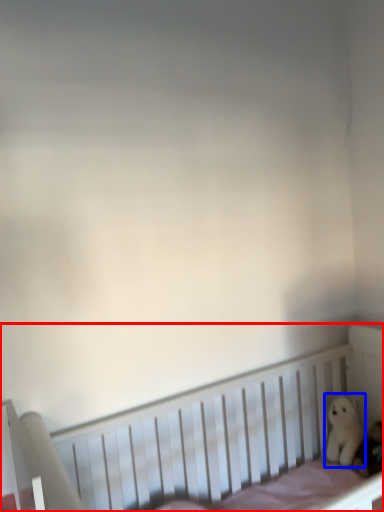
Question: Which point is further to the camera, infant bed (highlighted by a red box) or toy (highlighted by a blue box)?

Choices:
 (A) infant bed
 (B) toy

Answer: (B)